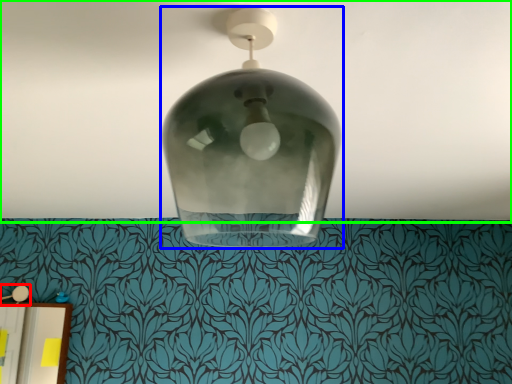
Question: Which object is positioned farthest from lamp (highlighted by a red box)? Select from lamp (highlighted by a blue box) and atmosphere (highlighted by a green box).

Choices:
 (A) lamp
 (B) atmosphere

Answer: (A)